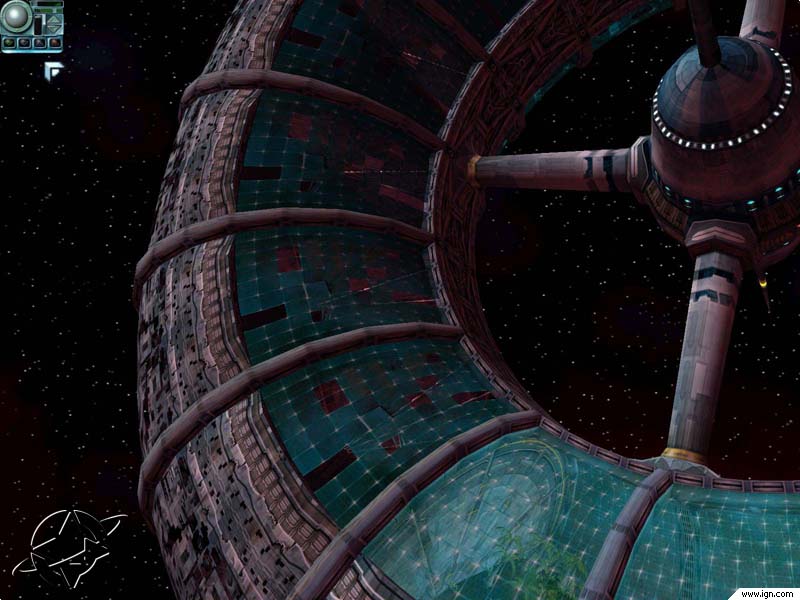
The image size is (800, 600). What are the coordinates of `plant inside large circular object` in the screenshot? It's located at (565, 566).